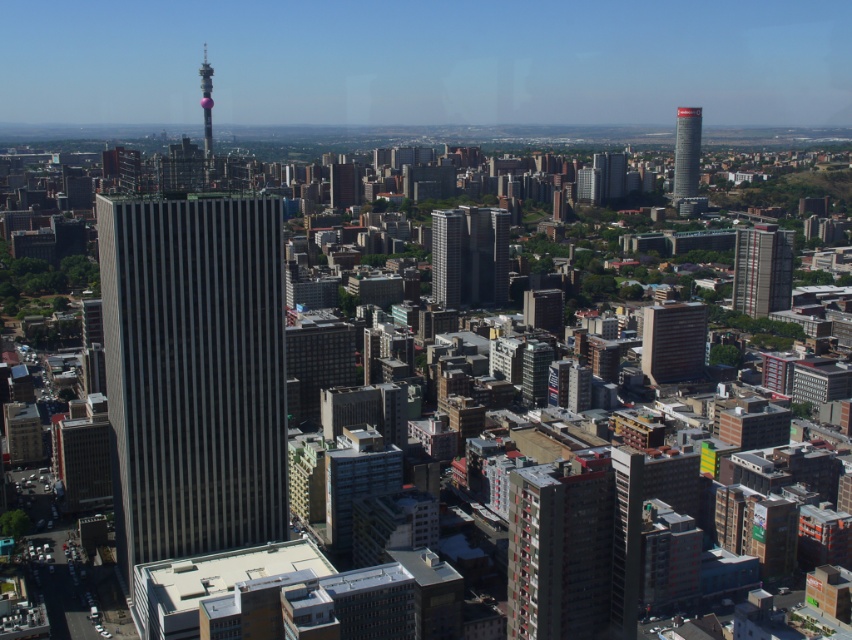
Does red brick building at right appear on the right side of smooth glass skyscraper at center?

Indeed, red brick building at right is positioned on the right side of smooth glass skyscraper at center.

Who is more distant from viewer, (757,259) or (494,241)?

The point (757,259) is more distant.

The height and width of the screenshot is (640, 852). Identify the location of red brick building at right. (763, 269).

Which of these two, dark gray glass skyscraper at center or smooth glass skyscraper at center, stands shorter?

Standing shorter between the two is smooth glass skyscraper at center.

Is point (153, 250) farther from camera compared to point (471, 268)?

No, it is not.

Locate an element on the screen. dark gray glass skyscraper at center is located at coordinates (193, 372).

What do you see at coordinates (560, 548) in the screenshot?
I see `red brick building at center` at bounding box center [560, 548].

Looking at this image, between red brick building at center and red brick building at right, which one is positioned lower?

Positioned lower is red brick building at center.

From the picture: Who is more forward, (x=590, y=556) or (x=763, y=292)?

Positioned in front is point (x=590, y=556).

The height and width of the screenshot is (640, 852). I want to click on red brick building at center, so click(560, 548).